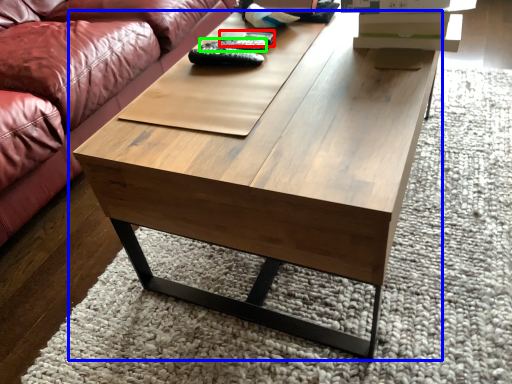
Question: Which object is the farthest from remote (highlighted by a red box)? Choose among these: coffee table (highlighted by a blue box) or remote (highlighted by a green box).

Choices:
 (A) coffee table
 (B) remote

Answer: (A)